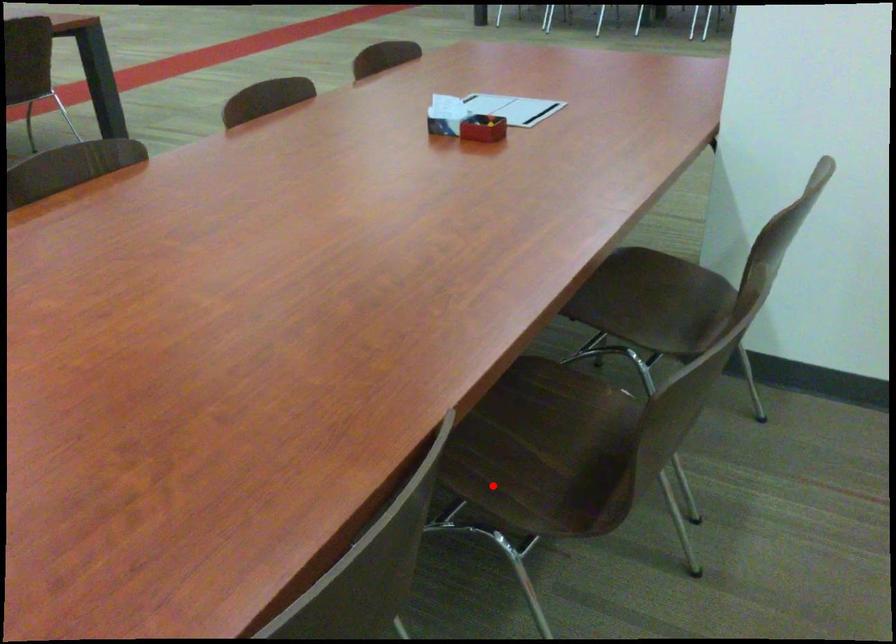
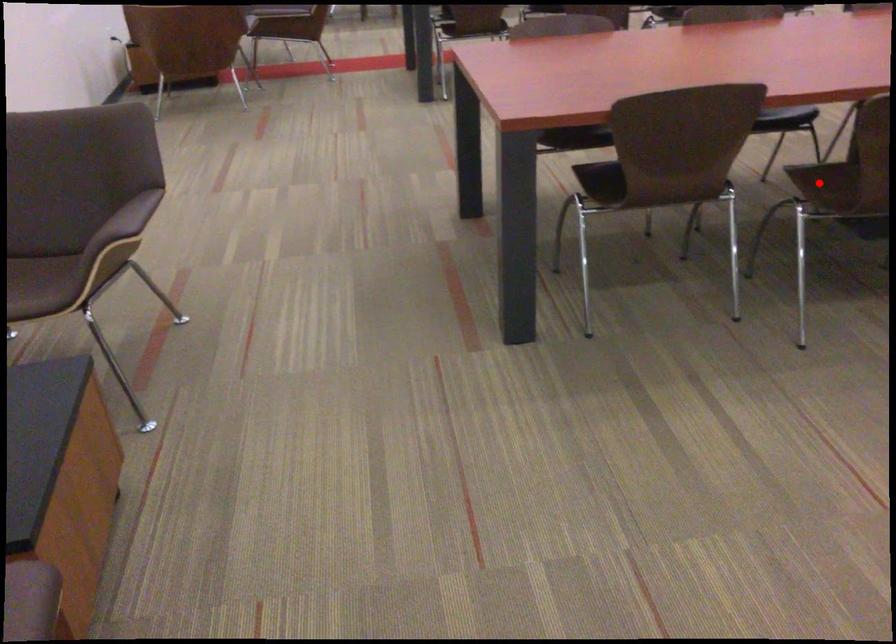
I am providing you with two images of the same scene from different viewpoints. A red point is marked on the first image and another point is marked on the second image. Is the marked point in image1 the same physical position as the marked point in image2?

Yes